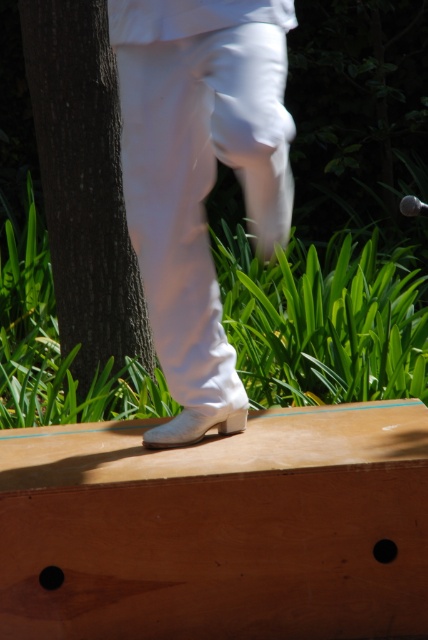
You are a photographer setting up a shoot in this outdoor scene. You need to position the white leather boot at center and the brown rough bark at left in such a way that they are both visible in the frame. Considering their heights, which object should be placed closer to the camera to ensure both are fully visible?

The white leather boot at center is not as tall as the brown rough bark at left, so to ensure both are fully visible, the brown rough bark at left should be placed closer to the camera. This way, its shorter height won not block the taller boot, allowing both to be seen clearly.

You are a photographer trying to capture a detailed shot of the white leather boot at center. The camera is positioned at the point with coordinates point (199, 177). Can you determine if the camera is directly above the boot?

The point (199, 177) indicates the white leather boot at center, so the camera is positioned directly above the boot.

You are a hiker who needs to place a 1.5 meter long hiking pole between the white leather boot at center and the brown rough bark at left. Can you fit the pole horizontally between them?

The distance between the white leather boot at center and the brown rough bark at left is 1.53 meters, so the 1.5 meter long hiking pole can fit horizontally between them as it is slightly shorter than the available space.